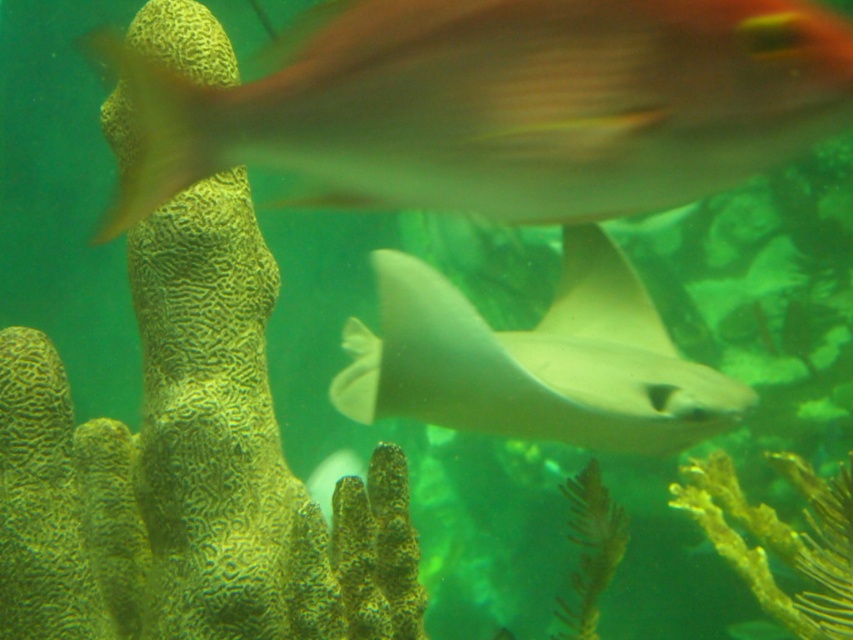
The width and height of the screenshot is (853, 640). In order to click on translucent white fish at upper center in this screenshot , I will do `click(503, 106)`.

Which is in front, point (177, 93) or point (718, 416)?

Positioned in front is point (177, 93).

Find the location of `translucent white fish at upper center`. translucent white fish at upper center is located at coordinates (503, 106).